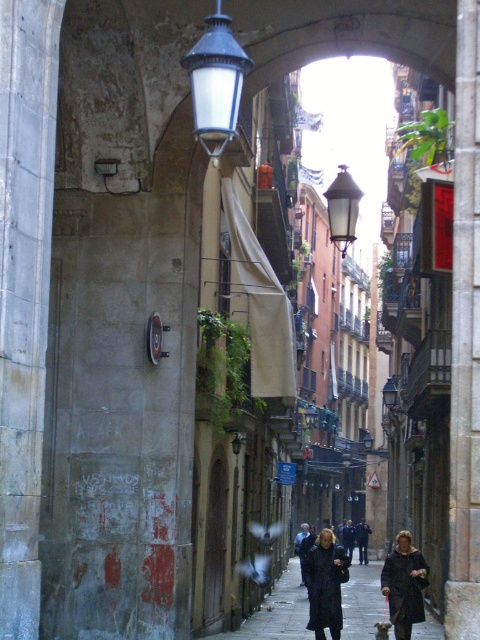
You are a delivery person with a cart that is 1.2 meters wide. You need to navigate through the narrow historic street. Can your cart fit between the smooth asphalt sidewalk at center and the matte glass lamp at upper center?

The smooth asphalt sidewalk at center is wider than the matte glass lamp at upper center. Since the sidewalk is wider, the cart might fit, but the exact width isn not specified. However, the description only states the sidewalk surpasses the lamp in width, not the available space between them. Thus, it is uncertain if the 1.2 meter cart can pass safely.

You are a delivery person trying to navigate through the narrow historic street. You need to place a package on the smooth asphalt sidewalk at center. To avoid hitting the matte glass lamp at upper center, which direction should you move relative to the lamp?

You should move to the right of the matte glass lamp at upper center because the smooth asphalt sidewalk at center is located to the right of the matte glass lamp at upper center.